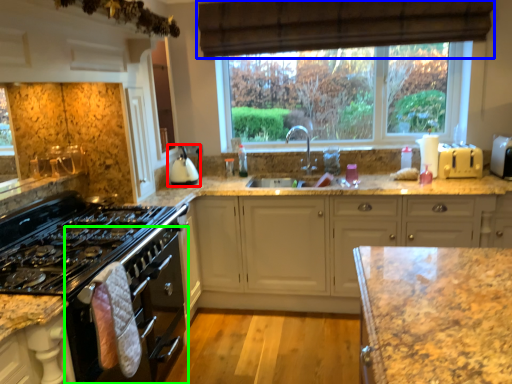
Question: Estimate the real-world distances between objects in this image. Which object is farther from kitchen appliance (highlighted by a red box), curtain (highlighted by a blue box) or oven (highlighted by a green box)?

Choices:
 (A) curtain
 (B) oven

Answer: (A)